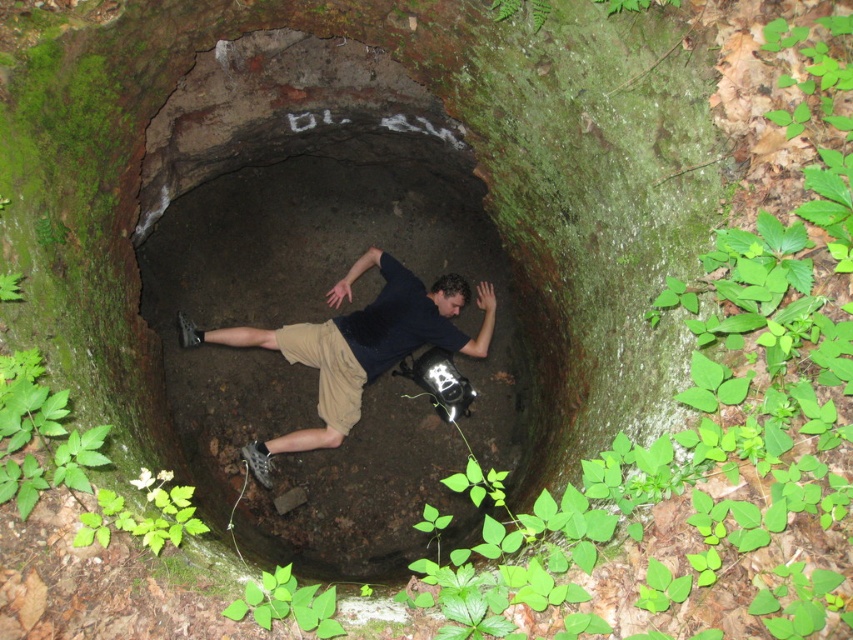
Looking at this image, between brown dirt cave at center and khaki cotton shorts at center, which one appears on the left side from the viewer's perspective?

Positioned to the left is khaki cotton shorts at center.

Is brown dirt cave at center above khaki cotton shorts at center?

Yes, brown dirt cave at center is above khaki cotton shorts at center.

Describe the element at coordinates (303, 230) in the screenshot. The image size is (853, 640). I see `brown dirt cave at center` at that location.

At what (x,y) coordinates should I click in order to perform the action: click on brown dirt cave at center. Please return your answer as a coordinate pair (x, y). Looking at the image, I should click on (303, 230).

How far apart are black matte shirt at center and khaki cotton shorts at center?

They are 22.77 centimeters apart.

Does black matte shirt at center have a greater width compared to khaki cotton shorts at center?

Indeed, black matte shirt at center has a greater width compared to khaki cotton shorts at center.

The width and height of the screenshot is (853, 640). In order to click on black matte shirt at center in this screenshot , I will do `click(357, 346)`.

Locate an element on the screen. black matte shirt at center is located at coordinates (357, 346).

Is brown dirt cave at center thinner than black matte shirt at center?

In fact, brown dirt cave at center might be wider than black matte shirt at center.

Is brown dirt cave at center below black matte shirt at center?

No.

In order to click on brown dirt cave at center in this screenshot , I will do `click(303, 230)`.